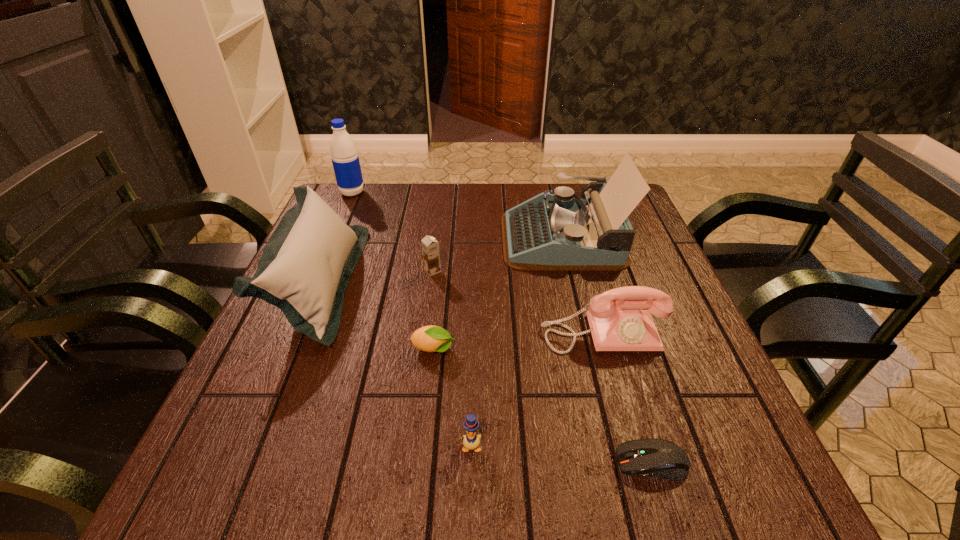
This screenshot has height=540, width=960. I want to click on water bottle, so click(x=345, y=159).

You are a GUI agent. You are given a task and a screenshot of the screen. Output one action in this format:
    pyautogui.click(x=<x>, y=<y>)
    Task: Click on the typewriter
    
    Given the screenshot: What is the action you would take?
    pyautogui.click(x=550, y=232)

Locate an element on the screen. The image size is (960, 540). cushion is located at coordinates click(304, 269).

Where is `telephone`? The height and width of the screenshot is (540, 960). telephone is located at coordinates (621, 325).

You are a GUI agent. You are given a task and a screenshot of the screen. Output one action in this format:
    pyautogui.click(x=<x>, y=<y>)
    Task: Click on the fourth shortest object
    This screenshot has width=960, height=540.
    Given the screenshot: What is the action you would take?
    pyautogui.click(x=430, y=246)

Locate an element on the screen. This screenshot has width=960, height=540. the fifth object from left to right is located at coordinates (471, 441).

I want to click on duckling, so click(x=471, y=441).

Image resolution: width=960 pixels, height=540 pixels. I want to click on the second shortest object, so click(431, 338).

In order to click on the shortest object in this screenshot , I will do `click(659, 458)`.

Locate an element on the screen. free spot located 0.250m on the right of the farthest object is located at coordinates (444, 193).